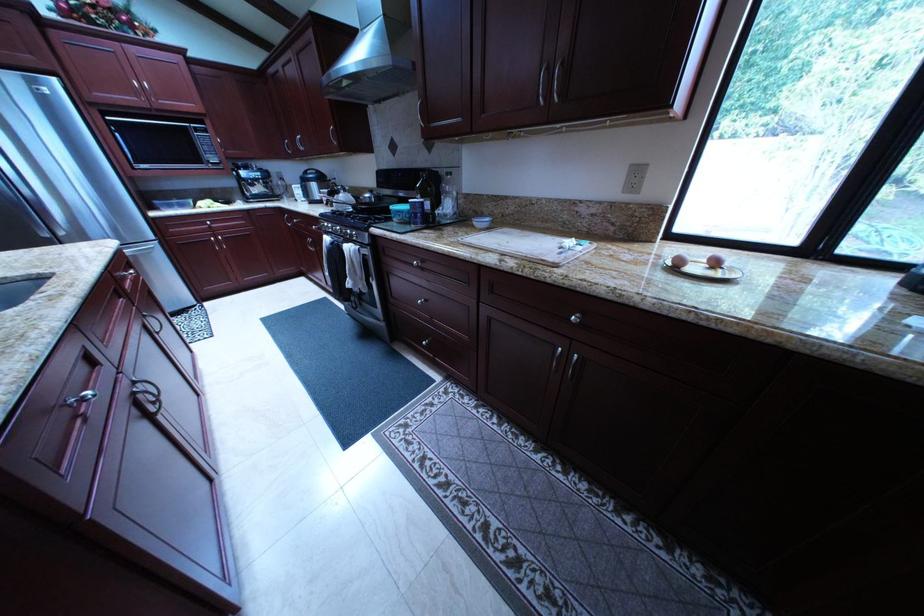
Where is `small white bowl`? small white bowl is located at coordinates (481, 222).